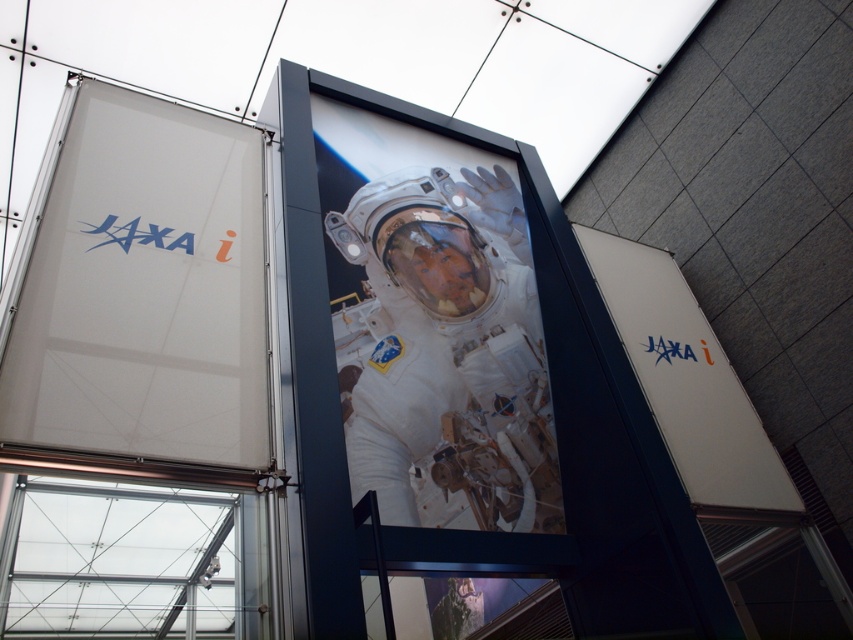
You are standing in front of the display panel and want to read both the white fabric sign at upper left and the white matte sign at center. Which sign will you be able to read first without moving your head?

The white fabric sign at upper left is closer to the viewer than the white matte sign at center, so you will be able to read the white fabric sign at upper left first without moving your head.

You are an astronaut preparing for a mission briefing. You notice two signs in the display panel. Which one is smaller in size between the white fabric sign at upper left and the white matte sign at center?

The white fabric sign at upper left is smaller in size compared to the white matte sign at center.